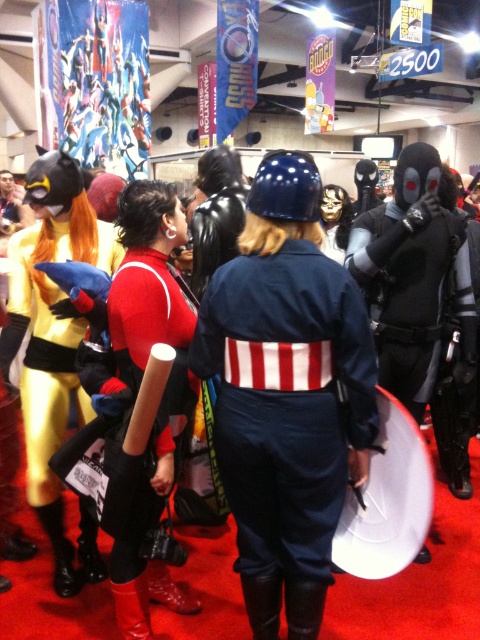
Which is above, blue fabric uniform at center or rubberized red boots at center?

blue fabric uniform at center

Who is more distant from viewer, (247, 506) or (109, 291)?

Point (109, 291)

Where is `blue fabric uniform at center`? blue fabric uniform at center is located at coordinates (287, 394).

Does blue fabric uniform at center appear on the left side of yellow fabric costume at left?

Incorrect, blue fabric uniform at center is not on the left side of yellow fabric costume at left.

Is blue fabric uniform at center above yellow fabric costume at left?

Actually, blue fabric uniform at center is below yellow fabric costume at left.

Which is in front, point (289, 435) or point (68, 173)?

Point (289, 435) is more forward.

At what (x,y) coordinates should I click in order to perform the action: click on blue fabric uniform at center. Please return your answer as a coordinate pair (x, y). The image size is (480, 640). Looking at the image, I should click on (287, 394).

Does point (311, 474) come behind point (82, 42)?

No, (311, 474) is closer to viewer.

Consider the image. Does blue fabric uniform at center have a lesser height compared to shiny metallic armor at upper left?

Correct, blue fabric uniform at center is not as tall as shiny metallic armor at upper left.

Is point (244, 493) behind point (112, 26)?

No, it is not.

Identify the location of blue fabric uniform at center. The width and height of the screenshot is (480, 640). (287, 394).